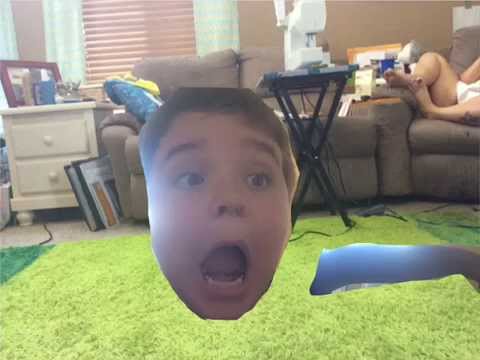
Locate an element on the screen. This screenshot has height=360, width=480. sewing machine is located at coordinates (317, 14).